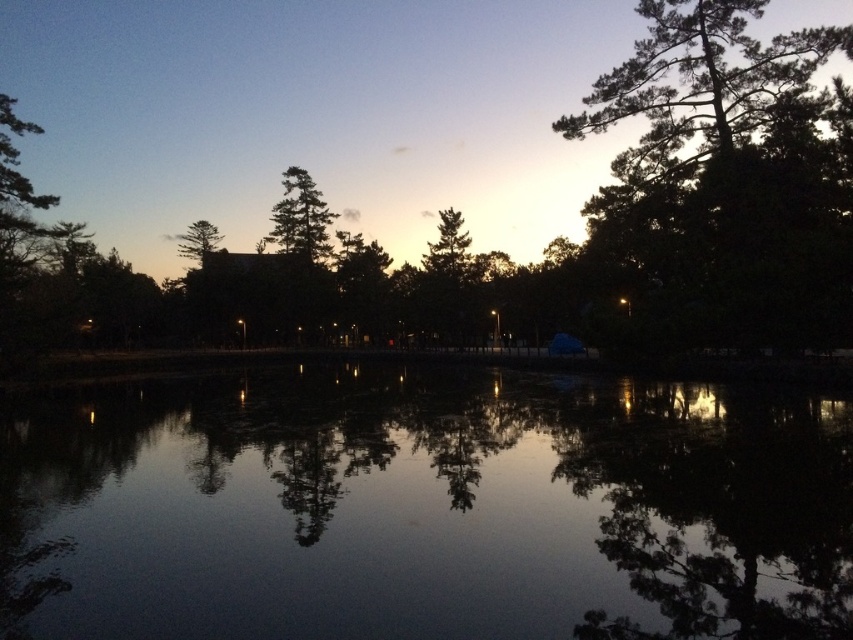
Question: Does black reflective water at center appear on the left side of green matte tree at upper center?

Choices:
 (A) yes
 (B) no

Answer: (B)

Question: Is green leafy tree at upper right bigger than green matte tree at upper center?

Choices:
 (A) no
 (B) yes

Answer: (B)

Question: Among these objects, which one is farthest from the camera?

Choices:
 (A) green matte tree at upper center
 (B) green leafy tree at upper right
 (C) black reflective water at center

Answer: (A)

Question: Among these points, which one is nearest to the camera?

Choices:
 (A) (300, 248)
 (B) (842, 403)

Answer: (B)

Question: Which object is positioned farthest from the green matte tree at upper center?

Choices:
 (A) green leafy tree at upper right
 (B) black reflective water at center

Answer: (B)

Question: Is the position of black reflective water at center more distant than that of green matte tree at upper center?

Choices:
 (A) yes
 (B) no

Answer: (B)